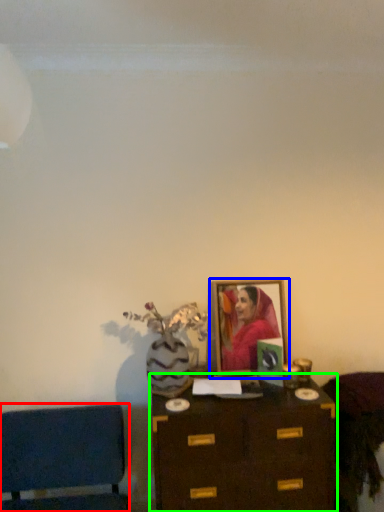
Question: Based on their relative distances, which object is farther from furniture (highlighted by a red box)? Choose from picture frame (highlighted by a blue box) and table (highlighted by a green box).

Choices:
 (A) picture frame
 (B) table

Answer: (A)